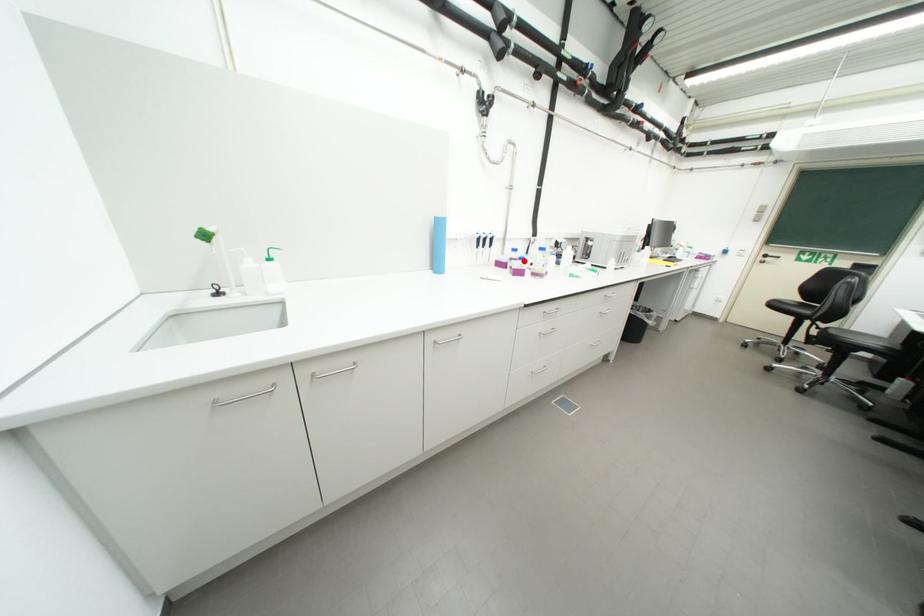
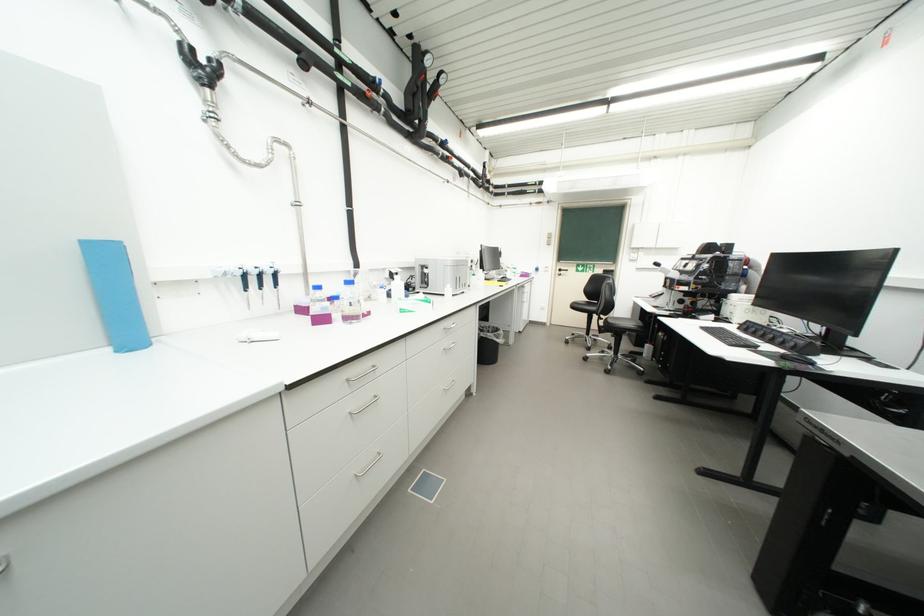
Question: I am providing you with two images of the same scene from different viewpoints. In image1, a red point is highlighted. Considering the same 3D point in image2, which of the following is correct?

Choices:
 (A) It is closer
 (B) It is farther

Answer: (B)